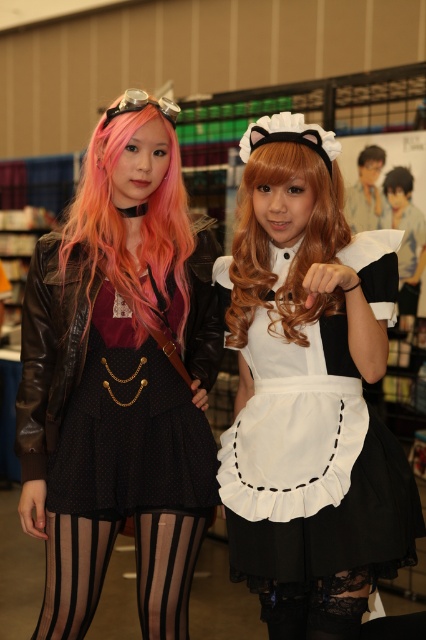
Image resolution: width=426 pixels, height=640 pixels. Identify the location of sheer black striped tights at lower center. (72, 573).

Identify the location of sheer black striped tights at lower center. The image size is (426, 640). (72, 573).

Which of these two, matte black dress at center or pinkhair at left, stands shorter?

pinkhair at left

Which is more to the left, matte black dress at center or pinkhair at left?

Positioned to the left is matte black dress at center.

Identify the location of matte black dress at center. The image size is (426, 640). (118, 384).

At what (x,y) coordinates should I click in order to perform the action: click on matte black dress at center. Please return your answer as a coordinate pair (x, y). The width and height of the screenshot is (426, 640). Looking at the image, I should click on click(x=118, y=384).

Consider the image. Between sheer black striped tights at lower center and golden wavy hair at center, which one appears on the left side from the viewer's perspective?

sheer black striped tights at lower center is more to the left.

Is point (195, 525) farther from viewer compared to point (268, 305)?

Yes, point (195, 525) is behind point (268, 305).

This screenshot has width=426, height=640. Find the location of `sheer black striped tights at lower center`. sheer black striped tights at lower center is located at coordinates (72, 573).